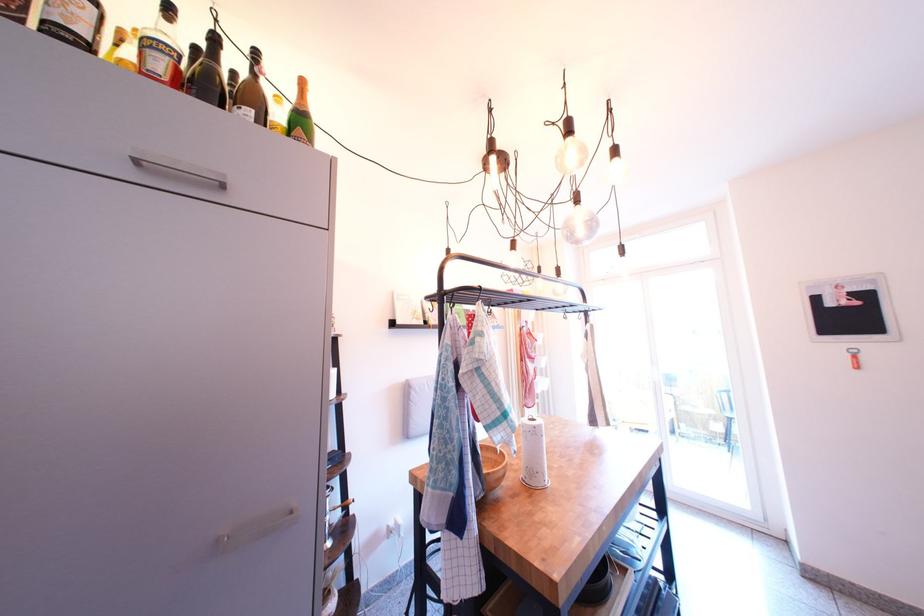
This screenshot has width=924, height=616. What are the coordinates of `red bottle opener` in the screenshot? It's located at (854, 358).